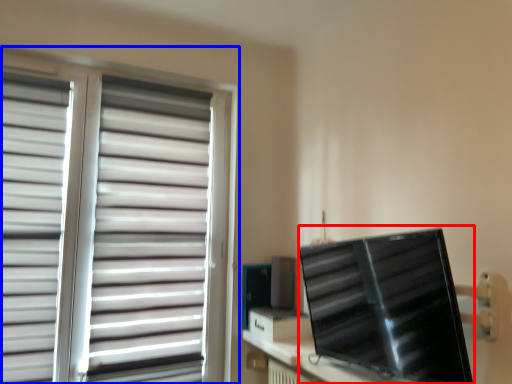
Question: Which of the following is the closest to the observer, computer monitor (highlighted by a red box) or window blind (highlighted by a blue box)?

Choices:
 (A) computer monitor
 (B) window blind

Answer: (A)